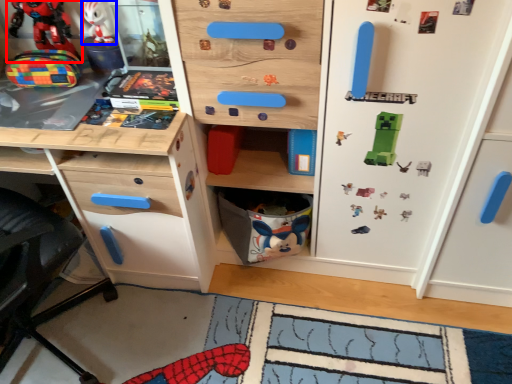
Question: Which object is closer to the camera taking this photo, toy (highlighted by a red box) or toy (highlighted by a blue box)?

Choices:
 (A) toy
 (B) toy

Answer: (A)